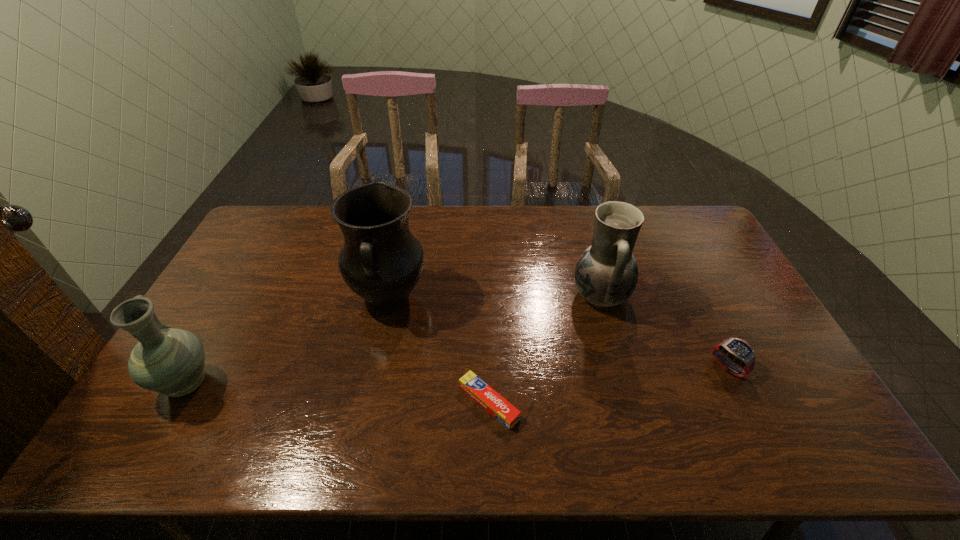
The image size is (960, 540). I want to click on free space that satisfies the following two spatial constraints: 1. on the front-facing side of the second object from right to left; 2. on the handle side of the second object from left to right, so click(x=601, y=297).

I want to click on free space that satisfies the following two spatial constraints: 1. on the handle side of the toothpaste; 2. on the left side of the second pitcher from right to left, so click(x=366, y=402).

Locate an element on the screen. vacant space that satisfies the following two spatial constraints: 1. on the front-facing side of the rightmost pitcher; 2. on the front side of the third object from left to right is located at coordinates (631, 402).

You are a GUI agent. You are given a task and a screenshot of the screen. Output one action in this format:
    pyautogui.click(x=<x>, y=<y>)
    Task: Click on the free spot that satisfies the following two spatial constraints: 1. on the handle side of the fourth object from right to left; 2. on the right side of the watch
    The height and width of the screenshot is (540, 960).
    Given the screenshot: What is the action you would take?
    pyautogui.click(x=373, y=367)

In order to click on vacant space that satisfies the following two spatial constraints: 1. on the handle side of the fourth object from right to left; 2. on the right side of the shortest object in this screenshot , I will do `click(366, 402)`.

You are a GUI agent. You are given a task and a screenshot of the screen. Output one action in this format:
    pyautogui.click(x=<x>, y=<y>)
    Task: Click on the vacant region that satisfies the following two spatial constraints: 1. on the handle side of the third object from right to left; 2. on the left side of the second pitcher from left to right
    Image resolution: width=960 pixels, height=540 pixels.
    Given the screenshot: What is the action you would take?
    pyautogui.click(x=366, y=402)